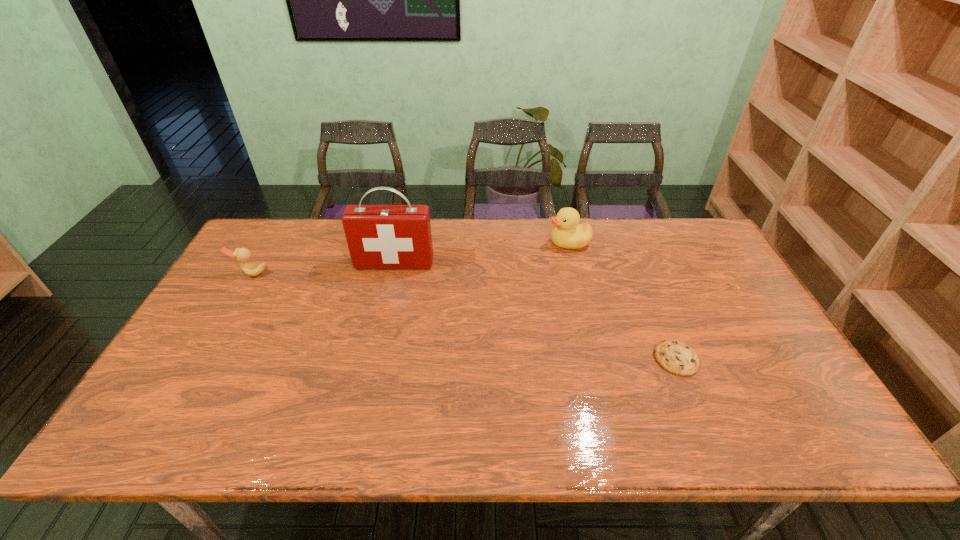
This screenshot has width=960, height=540. I want to click on vacant space at the right edge of the desktop, so click(x=769, y=354).

The height and width of the screenshot is (540, 960). In the image, there is a desktop. Find the location of `blank space at the far left corner`. blank space at the far left corner is located at coordinates (284, 238).

In the image, there is a desktop. Where is `vacant space at the near right corner`? Image resolution: width=960 pixels, height=540 pixels. vacant space at the near right corner is located at coordinates point(814,417).

What are the coordinates of `unoccupied area between the taller duck and the rightmost object` in the screenshot? It's located at tap(622, 301).

At what (x,y) coordinates should I click in order to perform the action: click on vacant point located between the nearest object and the first-aid kit. Please return your answer as a coordinate pair (x, y). The width and height of the screenshot is (960, 540). Looking at the image, I should click on (535, 311).

At what (x,y) coordinates should I click in order to perform the action: click on free spot between the leftmost object and the shortest object. Please return your answer as a coordinate pair (x, y). Looking at the image, I should click on click(x=464, y=316).

Find the location of `unoccupied position between the third object from right to left and the nearest object`. unoccupied position between the third object from right to left and the nearest object is located at coordinates (535, 311).

What are the coordinates of `blank region between the cookie and the first-aid kit` in the screenshot? It's located at (535, 311).

The width and height of the screenshot is (960, 540). I want to click on unoccupied position between the second object from left to right and the cookie, so click(535, 311).

In order to click on free space between the left duck and the tallest object in this screenshot , I will do `click(323, 268)`.